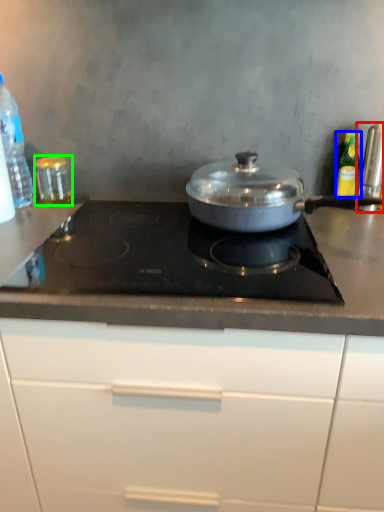
Question: Based on their relative distances, which object is nearer to kitchen appliance (highlighted by a red box)? Choose from kitchen appliance (highlighted by a blue box) and kitchen appliance (highlighted by a green box).

Choices:
 (A) kitchen appliance
 (B) kitchen appliance

Answer: (A)